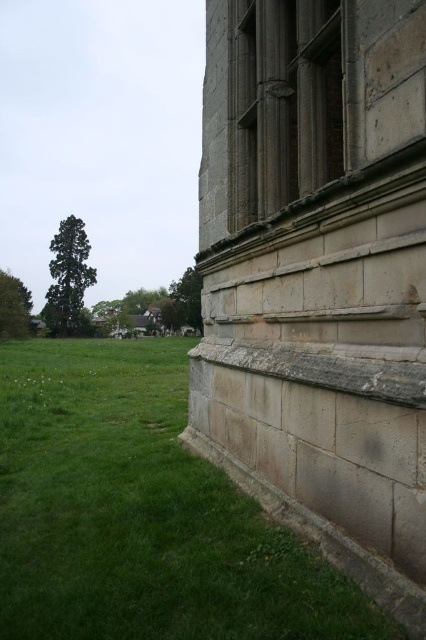
Between green grass at lower left and dark gray stone window at upper right, which one has more height?

Standing taller between the two is dark gray stone window at upper right.

Locate an element on the screen. Image resolution: width=426 pixels, height=640 pixels. green grass at lower left is located at coordinates (141, 513).